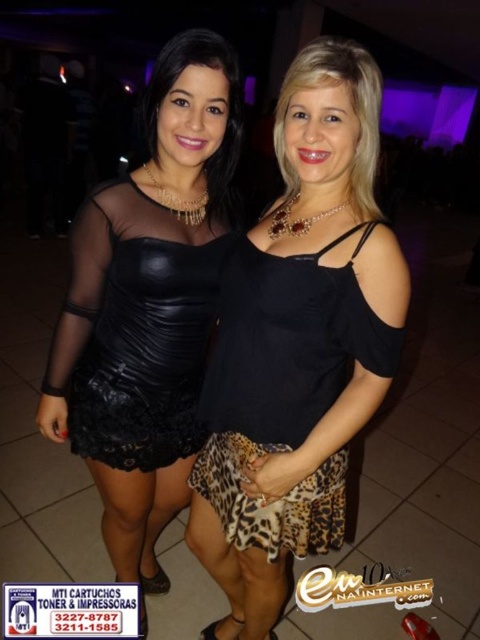
You are at a party and want to find the matte black dress at center. Which direction should you look relative to the black leather dress at left?

The matte black dress at center is to the right of the black leather dress at left.

You are a photographer at a party and need to capture both the matte black dress at center and the black leather dress at left clearly. Since the lighting is low, you want to ensure that the dress in the front doesn not block the other. Which dress should you focus on to make sure the one behind is visible?

The matte black dress at center is in front of the black leather dress at left. To ensure the black leather dress at left is visible behind, focus on the matte black dress at center so the other remains in the frame without obstruction.